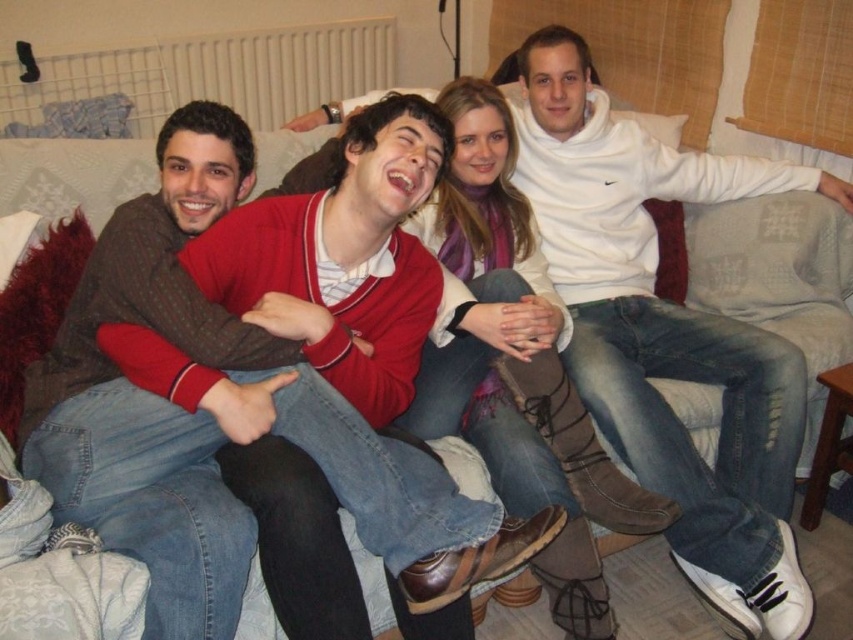
Question: Which point appears farthest from the camera in this image?

Choices:
 (A) (393, 358)
 (B) (480, 324)

Answer: (B)

Question: Can you confirm if matte red sweater at center is positioned below brown leather boots at center?

Choices:
 (A) yes
 (B) no

Answer: (A)

Question: Which of the following is the closest to the observer?

Choices:
 (A) matte red sweater at center
 (B) brown leather boots at center

Answer: (A)

Question: Considering the relative positions of matte red sweater at center and brown leather boots at center in the image provided, where is matte red sweater at center located with respect to brown leather boots at center?

Choices:
 (A) above
 (B) below

Answer: (B)

Question: Does matte red sweater at center have a larger size compared to brown leather boots at center?

Choices:
 (A) no
 (B) yes

Answer: (B)